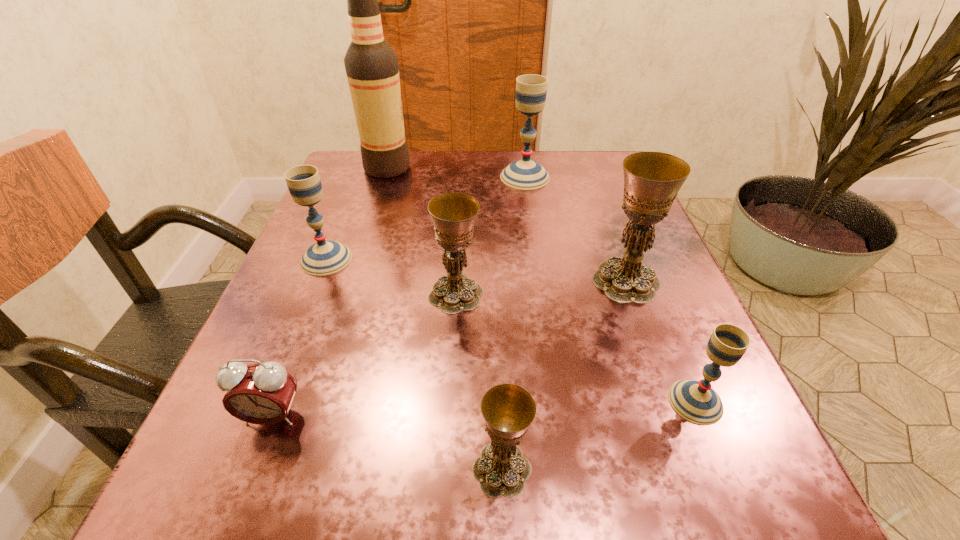
You are a GUI agent. You are given a task and a screenshot of the screen. Output one action in this format:
    pyautogui.click(x=<x>, y=<y>)
    Task: Click on the free region located 0.270m on the left of the nearest gold chalice
    The width and height of the screenshot is (960, 540).
    Given the screenshot: What is the action you would take?
    pyautogui.click(x=248, y=469)

Locate an element on the screen. The height and width of the screenshot is (540, 960). vacant region located on the clock face of the shortest object is located at coordinates (252, 469).

The image size is (960, 540). Identify the location of alcohol at the far edge. (372, 70).

At what (x,y) coordinates should I click in order to perform the action: click on chalice present at the far edge. Please return your answer as a coordinate pair (x, y). This screenshot has width=960, height=540. Looking at the image, I should click on (531, 90).

Locate an element on the screen. Image resolution: width=960 pixels, height=540 pixels. object at the near edge is located at coordinates (508, 410).

Locate an element on the screen. The image size is (960, 540). alcohol present at the left edge is located at coordinates (372, 70).

Where is `chalice positioned at the left edge`? This screenshot has height=540, width=960. chalice positioned at the left edge is located at coordinates (325, 257).

I want to click on alarm clock situated at the left edge, so click(262, 393).

Identify the location of object that is at the far left corner. (372, 70).

Identify the location of free region at the far edge. The width and height of the screenshot is (960, 540). (546, 191).